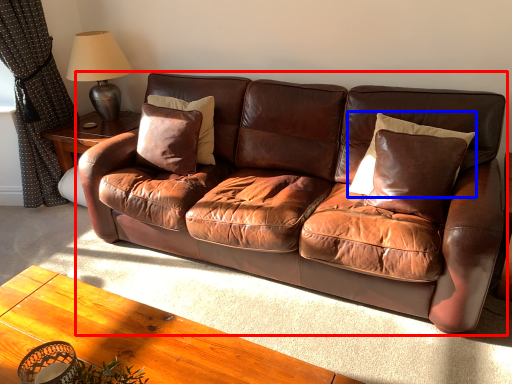
Question: Which object is further to the camera taking this photo, studio couch (highlighted by a red box) or pillow (highlighted by a blue box)?

Choices:
 (A) studio couch
 (B) pillow

Answer: (B)